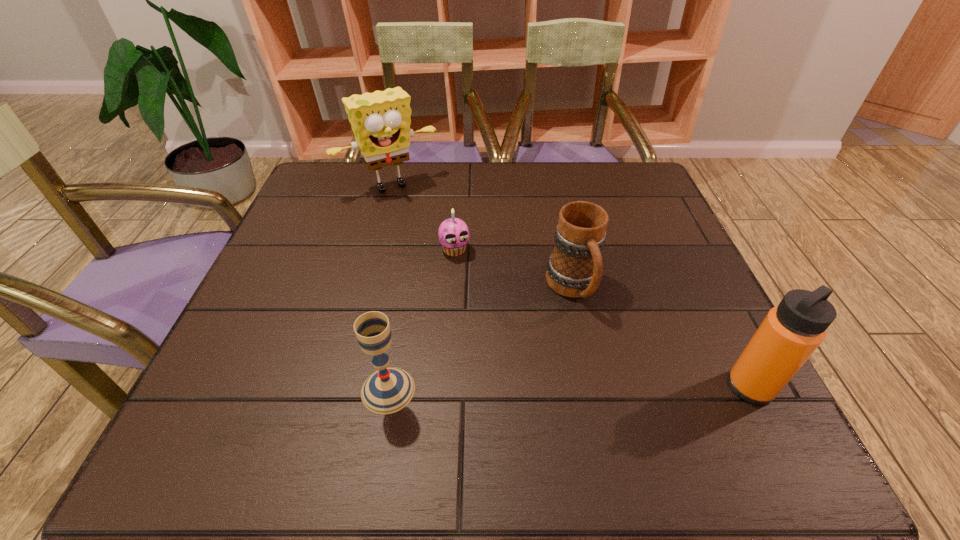
The width and height of the screenshot is (960, 540). In order to click on chalice in this screenshot , I will do `click(388, 390)`.

Identify the location of thermos bottle. Image resolution: width=960 pixels, height=540 pixels. point(789,334).

Where is `the third object from right to left`? the third object from right to left is located at coordinates (453, 233).

Where is `cupcake`? This screenshot has width=960, height=540. cupcake is located at coordinates (453, 233).

You are a GUI agent. You are given a task and a screenshot of the screen. Output one action in this format:
    pyautogui.click(x=<x>, y=<y>)
    Task: Click on the farthest object
    This screenshot has width=960, height=540.
    Given the screenshot: What is the action you would take?
    pyautogui.click(x=381, y=120)

At what (x,y) coordinates should I click in order to perform the action: click on the third farthest object. Please return your answer as a coordinate pair (x, y). Image resolution: width=960 pixels, height=540 pixels. Looking at the image, I should click on (574, 269).

This screenshot has width=960, height=540. What are the coordinates of `mug` in the screenshot? It's located at (574, 269).

The width and height of the screenshot is (960, 540). Identify the location of vacant space positioned 0.060m on the back of the chalice. (396, 341).

Find the location of `free space located on the left of the rightmost object`. free space located on the left of the rightmost object is located at coordinates click(632, 387).

In order to click on free location located 0.210m on the face of the third object from left to right in this screenshot , I will do `click(490, 327)`.